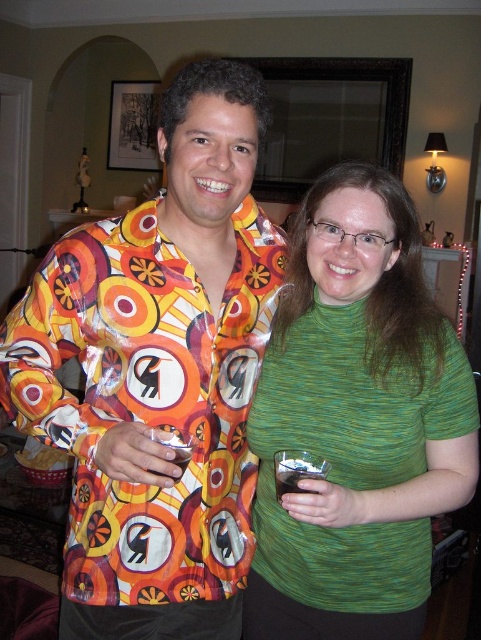
Question: Considering the relative positions of green knit turtleneck at center and transparent plastic wine glass at lower center in the image provided, where is green knit turtleneck at center located with respect to transparent plastic wine glass at lower center?

Choices:
 (A) right
 (B) left

Answer: (A)

Question: Does transparent plastic wine glass at lower center appear on the right side of transparent plastic wine glass at center?

Choices:
 (A) no
 (B) yes

Answer: (B)

Question: Is green knit turtleneck at center above transparent plastic wine glass at lower center?

Choices:
 (A) no
 (B) yes

Answer: (B)

Question: Which point is closer to the camera?

Choices:
 (A) transparent plastic wine glass at center
 (B) transparent plastic wine glass at lower center

Answer: (A)

Question: Among these points, which one is nearest to the camera?

Choices:
 (A) (156, 472)
 (B) (294, 472)

Answer: (B)

Question: Which object is positioned farthest from the transparent plastic wine glass at center?

Choices:
 (A) green knit turtleneck at center
 (B) transparent plastic wine glass at lower center

Answer: (A)